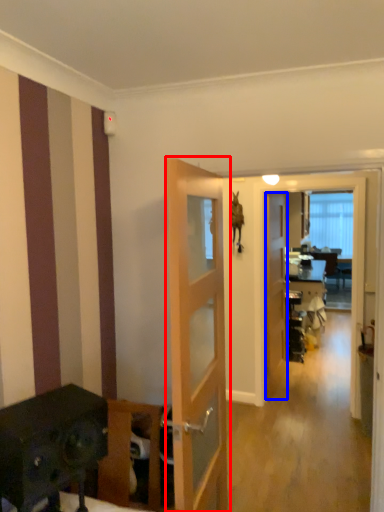
Question: Which object appears farthest to the camera in this image, door (highlighted by a red box) or door (highlighted by a blue box)?

Choices:
 (A) door
 (B) door

Answer: (B)